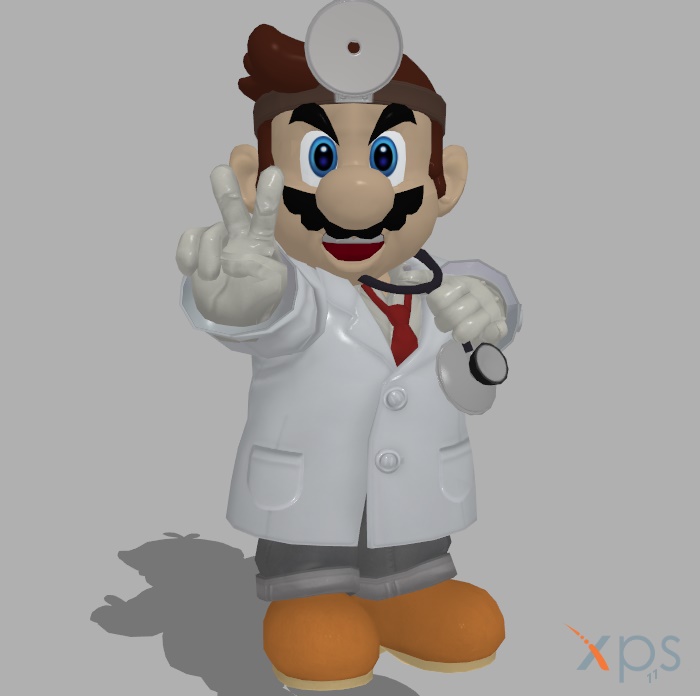
Identify the location of 2 shoes. (311, 624), (463, 633).